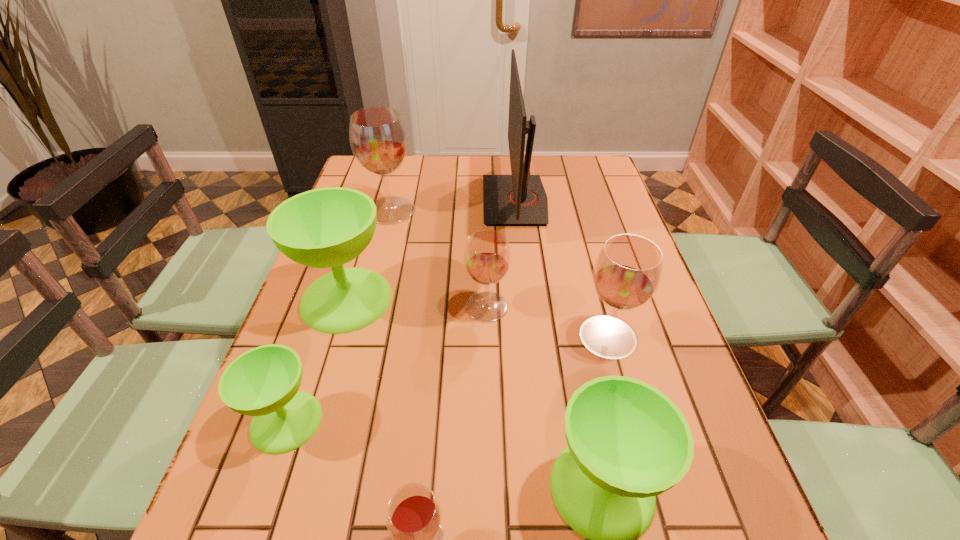
You are a GUI agent. You are given a task and a screenshot of the screen. Output one action in this format:
    pyautogui.click(x=<x>, y=<y>)
    Task: Click on the monitor
    
    Given the screenshot: What is the action you would take?
    [x=519, y=199]

Find the location of a particular element. The width and height of the screenshot is (960, 540). black monitor is located at coordinates (519, 199).

This screenshot has width=960, height=540. Find the location of `the tallest wineglass`. the tallest wineglass is located at coordinates (378, 139).

This screenshot has height=540, width=960. In order to click on the farthest red wineglass in this screenshot , I will do point(378,139).

This screenshot has width=960, height=540. What are the coordinates of `the third smallest red wineglass` in the screenshot? It's located at (627, 272).

Find the location of a particular element. the biggest green wineglass is located at coordinates (327, 227).

Find the location of `the fifth wineglass from left to right`. the fifth wineglass from left to right is located at coordinates (487, 256).

Image resolution: width=960 pixels, height=540 pixels. What are the coordinates of `the second smallest red wineglass` in the screenshot? It's located at (487, 256).

Where is `the smallest green wineglass`? The image size is (960, 540). the smallest green wineglass is located at coordinates (263, 382).

What are the coordinates of `free space located 0.200m on the screen side of the monitor` in the screenshot? It's located at (421, 200).